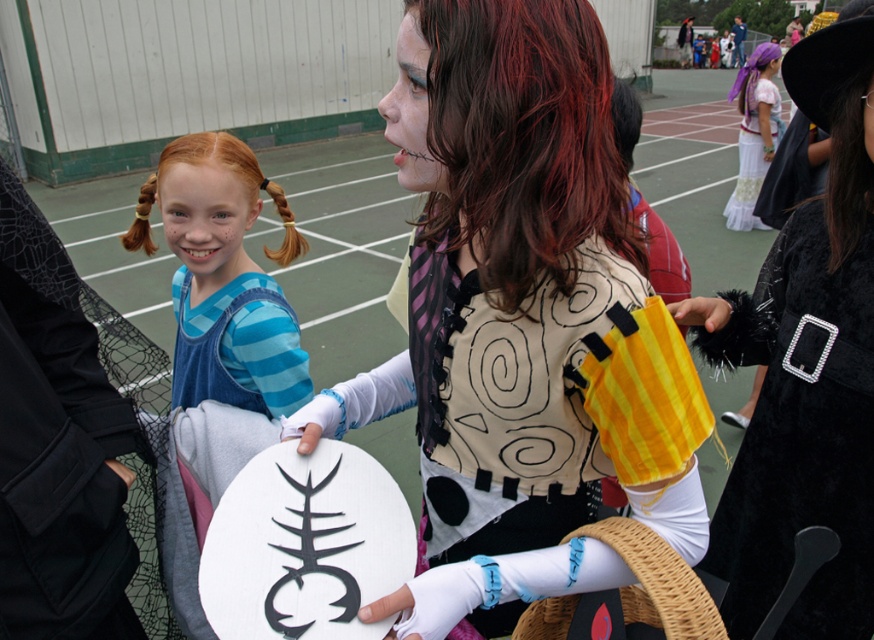
Who is positioned more to the right, velvet black cape at right or white cotton dress at upper right?

white cotton dress at upper right is more to the right.

Does point (754, 416) come farther from viewer compared to point (740, 205)?

No, (754, 416) is closer to viewer.

Where is `velvet black cape at right`? velvet black cape at right is located at coordinates (805, 369).

Is point (167, 236) farther from viewer compared to point (751, 76)?

No, it is in front of (751, 76).

Is point (188, 202) positioned in front of point (748, 227)?

Yes, it is.

This screenshot has height=640, width=874. I want to click on blue striped shirt at center, so click(224, 276).

Is matte black vest at center positioned before velvet black cape at right?

Yes.

From the picture: Does matte black vest at center appear on the left side of velvet black cape at right?

Yes, matte black vest at center is to the left of velvet black cape at right.

The height and width of the screenshot is (640, 874). Describe the element at coordinates (500, 300) in the screenshot. I see `matte black vest at center` at that location.

Identify the location of matte black vest at center. (500, 300).